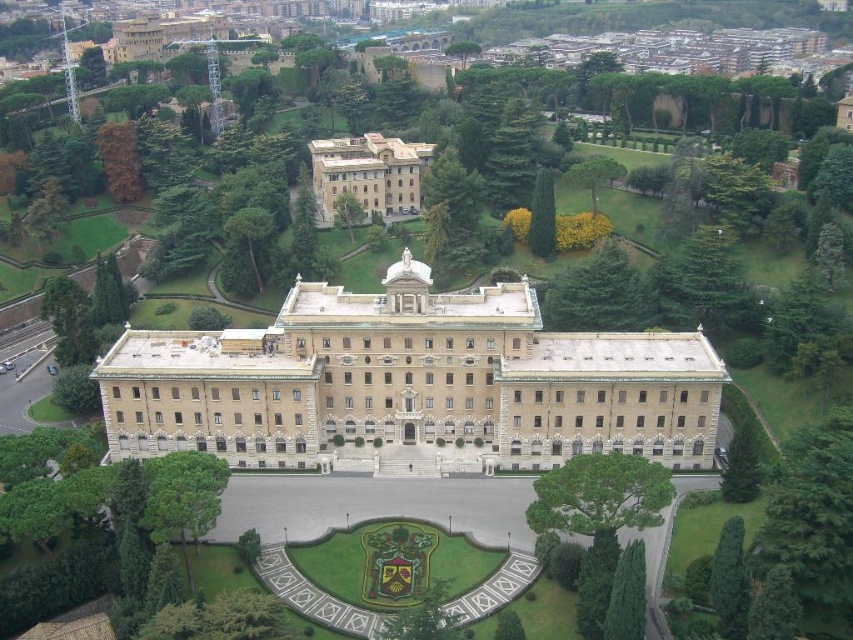
Identify the location of beige stone palace at center. pos(410,384).

Consider the image. Measure the distance between beige stone palace at center and camera.

beige stone palace at center and camera are 97.67 meters apart.

Where is `beige stone palace at center`? Image resolution: width=853 pixels, height=640 pixels. beige stone palace at center is located at coordinates (410, 384).